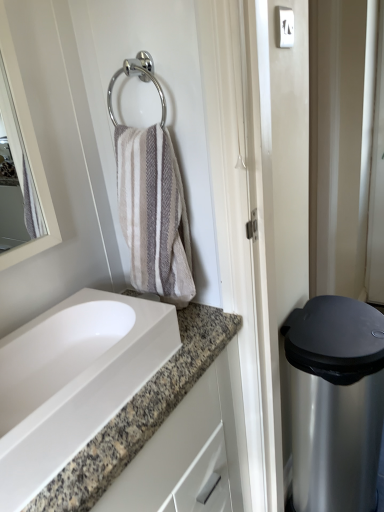
Question: From a real-world perspective, relative to chrome metallic towel ring at upper center, is satin silver trash can at right vertically above or below?

Choices:
 (A) below
 (B) above

Answer: (A)

Question: In terms of width, does satin silver trash can at right look wider or thinner when compared to chrome metallic towel ring at upper center?

Choices:
 (A) wide
 (B) thin

Answer: (A)

Question: Which object is the closest to the satin silver trash can at right?

Choices:
 (A) chrome metallic towel ring at upper center
 (B) white glossy sink at lower left

Answer: (B)

Question: Which object is positioned farthest from the satin silver trash can at right?

Choices:
 (A) chrome metallic towel ring at upper center
 (B) white glossy sink at lower left

Answer: (A)